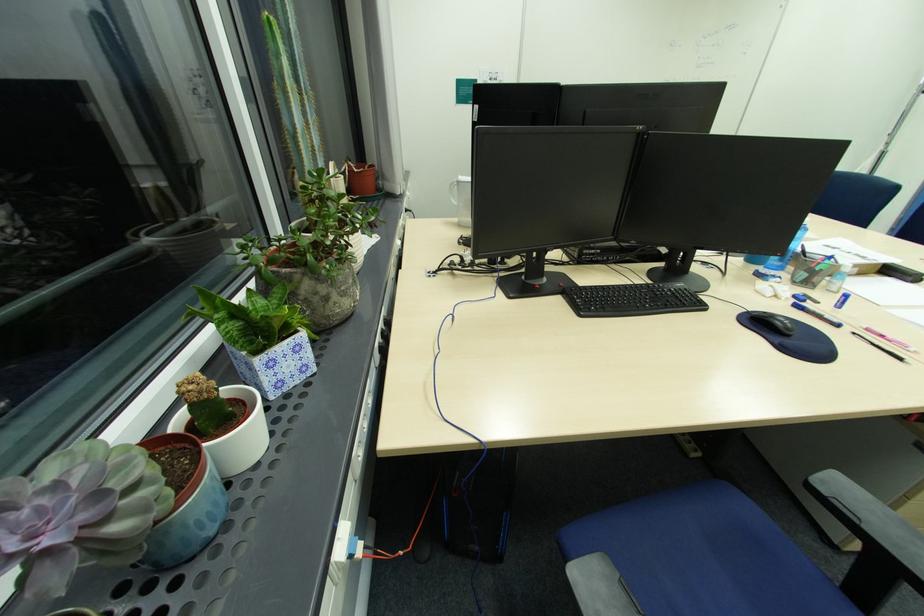
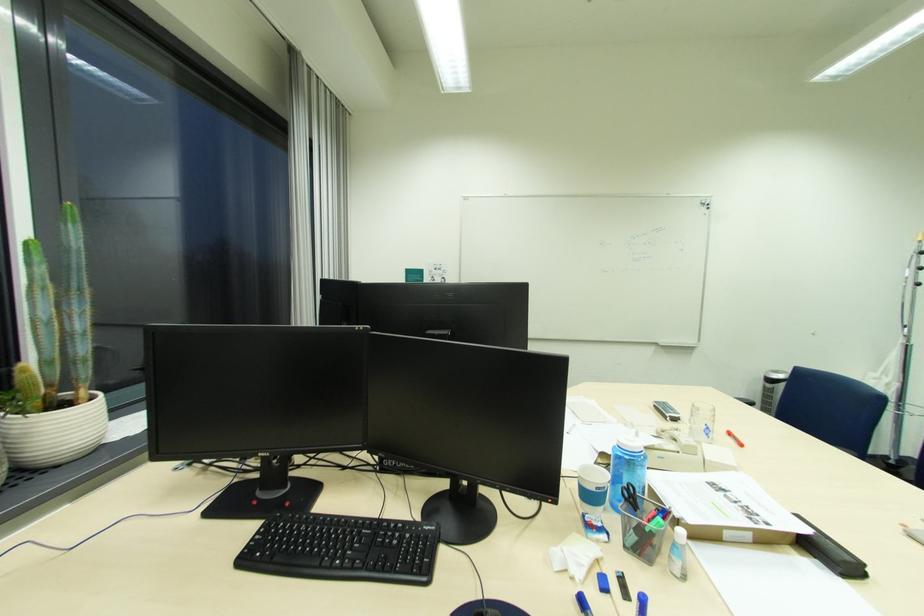
Where in the second image is the point corresponding to the point at 824,304 from the first image?

(636, 601)